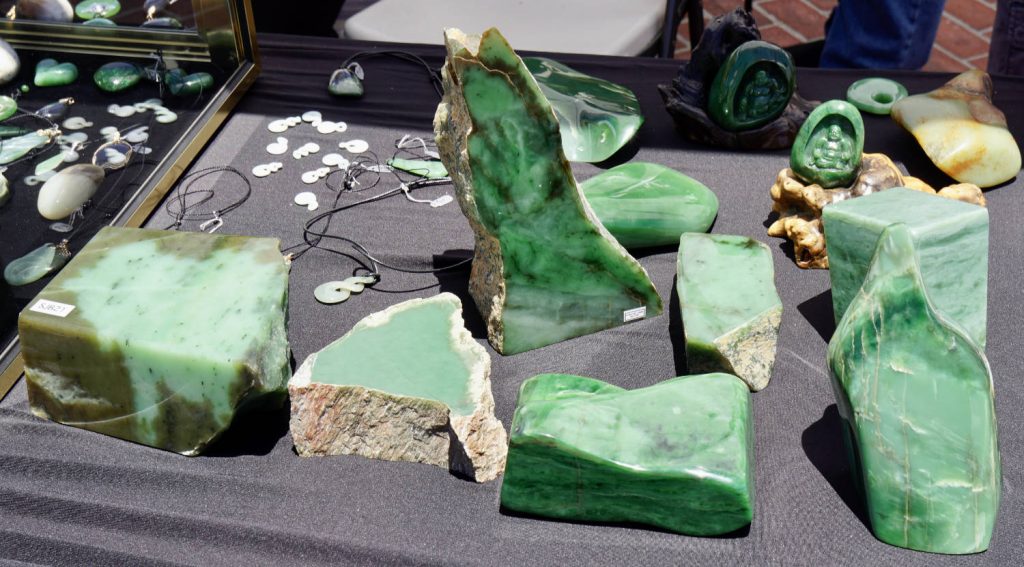
Locate an element on the screen. brick floor is located at coordinates (796, 16).